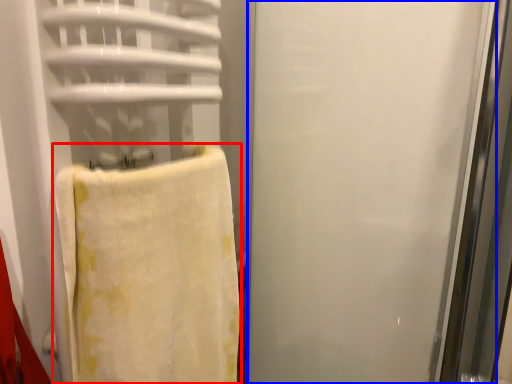
Question: Which object appears farthest to the camera in this image, towel (highlighted by a red box) or screen door (highlighted by a blue box)?

Choices:
 (A) towel
 (B) screen door

Answer: (B)